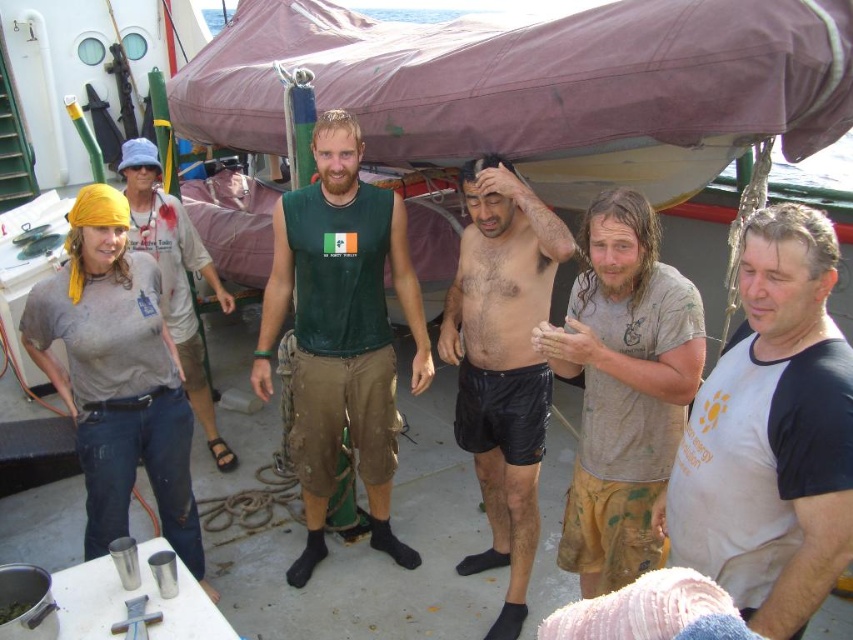
Question: Which of the following is the closest to the observer?

Choices:
 (A) white cotton t-shirt at center
 (B) green sleeveless shirt at center
 (C) brown cotton shirt at center
 (D) gray cotton t-shirt at upper left

Answer: (A)

Question: Can you confirm if white cotton t-shirt at center is positioned above green sleeveless shirt at center?

Choices:
 (A) yes
 (B) no

Answer: (B)

Question: Does white cotton t-shirt at center have a smaller size compared to black matte shorts at center?

Choices:
 (A) yes
 (B) no

Answer: (A)

Question: Can you confirm if white cotton t-shirt at center is positioned to the left of gray cotton t-shirt at upper left?

Choices:
 (A) yes
 (B) no

Answer: (B)

Question: Which point is farther from the camera taking this photo?

Choices:
 (A) (120, 518)
 (B) (177, 212)
 (C) (784, 237)
 (D) (328, 120)

Answer: (B)

Question: Which object is positioned farthest from the brown cotton shirt at center?

Choices:
 (A) black matte shorts at center
 (B) gray cotton t-shirt at upper left

Answer: (B)